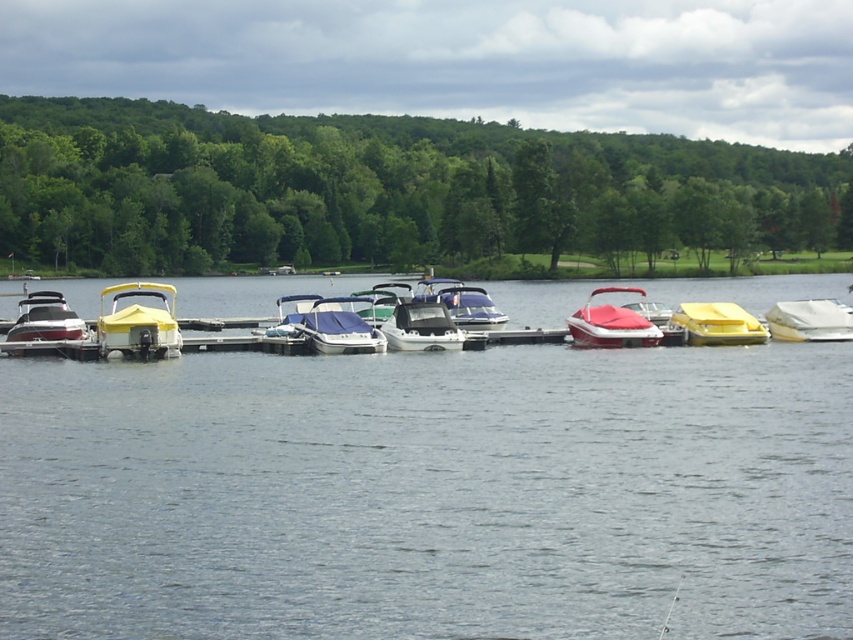
Does clear water at center appear over white matte boat at right?

Indeed, clear water at center is positioned over white matte boat at right.

Image resolution: width=853 pixels, height=640 pixels. Describe the element at coordinates (428, 493) in the screenshot. I see `clear water at center` at that location.

The width and height of the screenshot is (853, 640). What are the coordinates of `clear water at center` in the screenshot? It's located at (428, 493).

Can you confirm if yellow matte boat at center is positioned below white glossy boat at center?

Yes, yellow matte boat at center is below white glossy boat at center.

Does yellow matte boat at center have a greater height compared to white glossy boat at center?

No, yellow matte boat at center is not taller than white glossy boat at center.

Who is more distant from viewer, (x=694, y=320) or (x=445, y=310)?

The point (x=445, y=310) is behind.

Image resolution: width=853 pixels, height=640 pixels. Find the location of `yellow matte boat at center`. yellow matte boat at center is located at coordinates (718, 324).

Where is `clear water at center`? This screenshot has height=640, width=853. clear water at center is located at coordinates (x=428, y=493).

Is point (380, 550) positioned after point (334, 339)?

That is False.

You are a GUI agent. You are given a task and a screenshot of the screen. Output one action in this format:
    pyautogui.click(x=<x>, y=<y>)
    Task: Click on the clear water at center
    The height and width of the screenshot is (640, 853).
    Given the screenshot: What is the action you would take?
    pyautogui.click(x=428, y=493)